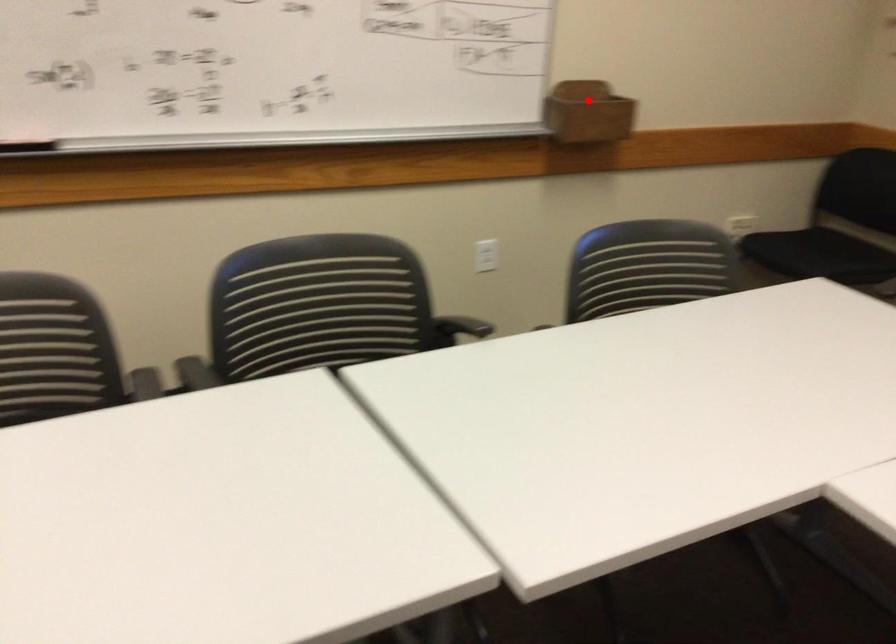
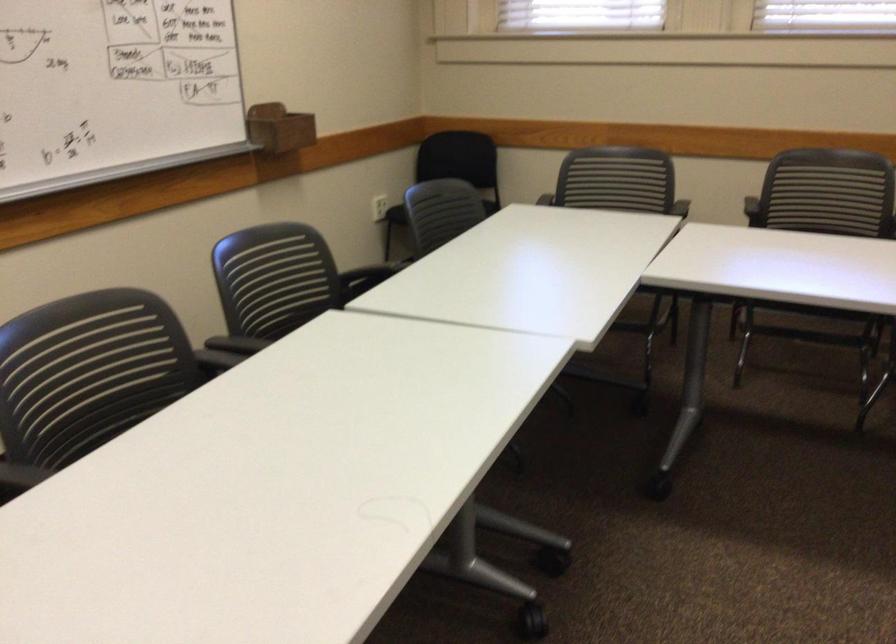
Locate, in the second image, the point that corresponds to the highlighted location in the first image.

(279, 128)